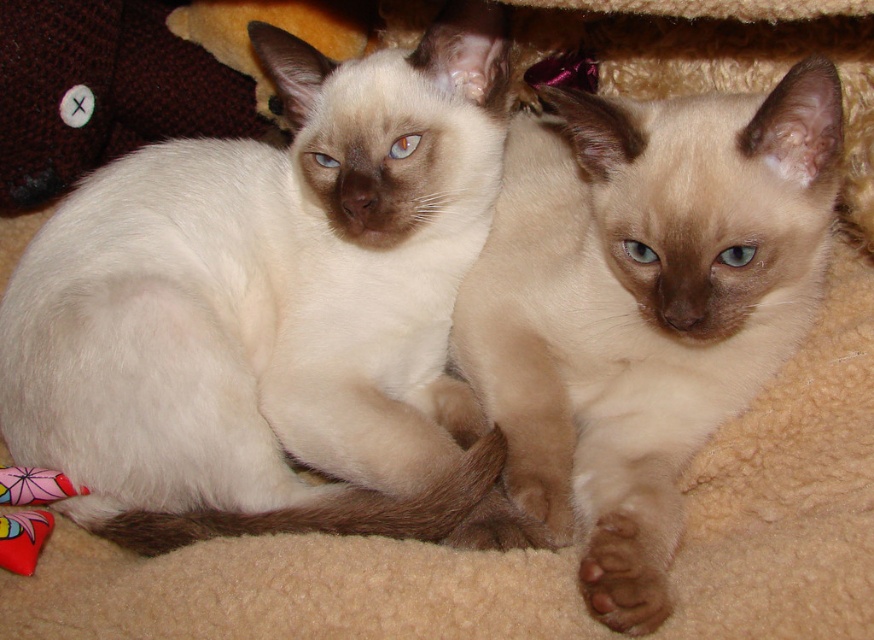
Who is positioned more to the right, silky white cat at center or silky cream cat at center?

Positioned to the right is silky cream cat at center.

Based on the photo, can you confirm if silky white cat at center is positioned below silky cream cat at center?

Actually, silky white cat at center is above silky cream cat at center.

This screenshot has width=874, height=640. In order to click on silky white cat at center in this screenshot , I will do `click(274, 310)`.